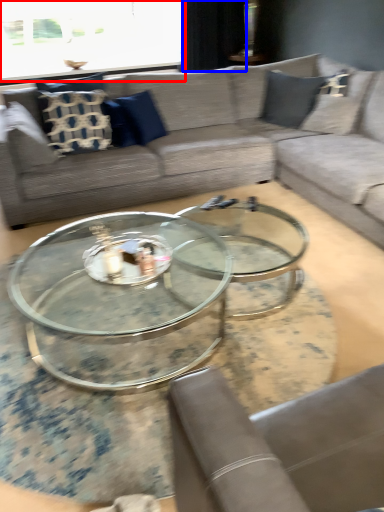
Question: Which object is further to the camera taking this photo, window screen (highlighted by a red box) or curtain (highlighted by a blue box)?

Choices:
 (A) window screen
 (B) curtain

Answer: (B)